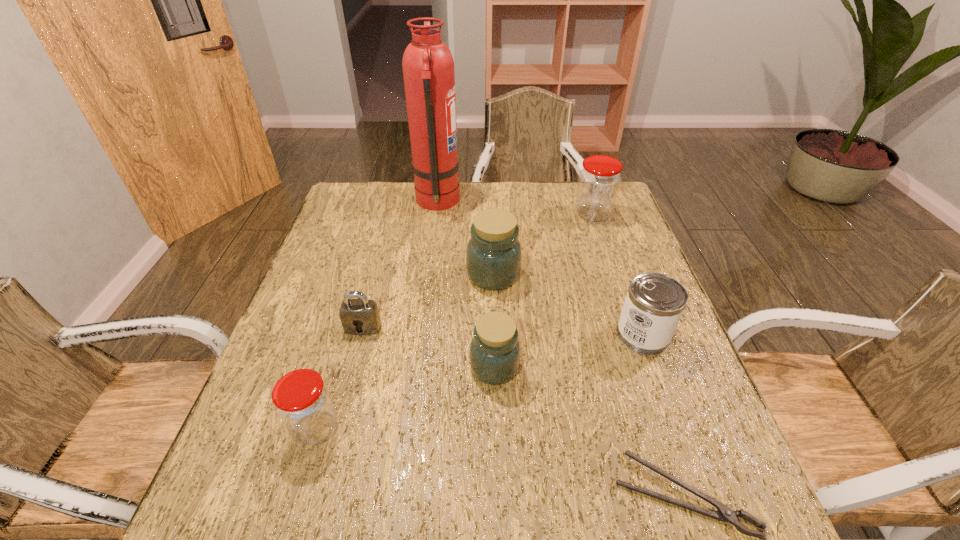
This screenshot has width=960, height=540. Identify the location of the nearest jar. (302, 400).

You are a GUI agent. You are given a task and a screenshot of the screen. Output one action in this format:
    pyautogui.click(x=<x>, y=<y>)
    Task: Click on the padlock
    This screenshot has height=540, width=960.
    Given the screenshot: What is the action you would take?
    pyautogui.click(x=360, y=316)

Locate an element on the screen. Image resolution: width=960 pixels, height=540 pixels. vacant area situated 0.340m on the label side of the sixth object from right to left is located at coordinates (563, 202).

I want to click on vacant point located 0.150m on the left of the bigger red jar, so tap(526, 214).

You are a GUI agent. You are given a task and a screenshot of the screen. Output one action in this format:
    pyautogui.click(x=<x>, y=<y>)
    Task: Click on the free space located 0.330m on the front of the third farthest object
    The width and height of the screenshot is (960, 540).
    Given the screenshot: What is the action you would take?
    pyautogui.click(x=498, y=408)

The width and height of the screenshot is (960, 540). I want to click on vacant area situated 0.250m on the front of the can, so click(x=689, y=465).

Locate an element on the screen. The image size is (960, 540). vacant space situated 0.120m on the front of the smaller green jar is located at coordinates (496, 442).

The width and height of the screenshot is (960, 540). Identify the location of vacant region located on the back of the leftmost jar. pos(358,285).

Find the location of a particular element. This screenshot has height=540, width=960. free space located 0.160m at the front of the padlock near the keyhole is located at coordinates (346, 395).

You are a GUI agent. You are given a task and a screenshot of the screen. Output one action in this format:
    pyautogui.click(x=<x>, y=<y>)
    Task: Click on the fire extinguisher present at the far edge
    Image resolution: width=960 pixels, height=540 pixels.
    Given the screenshot: What is the action you would take?
    pyautogui.click(x=428, y=67)